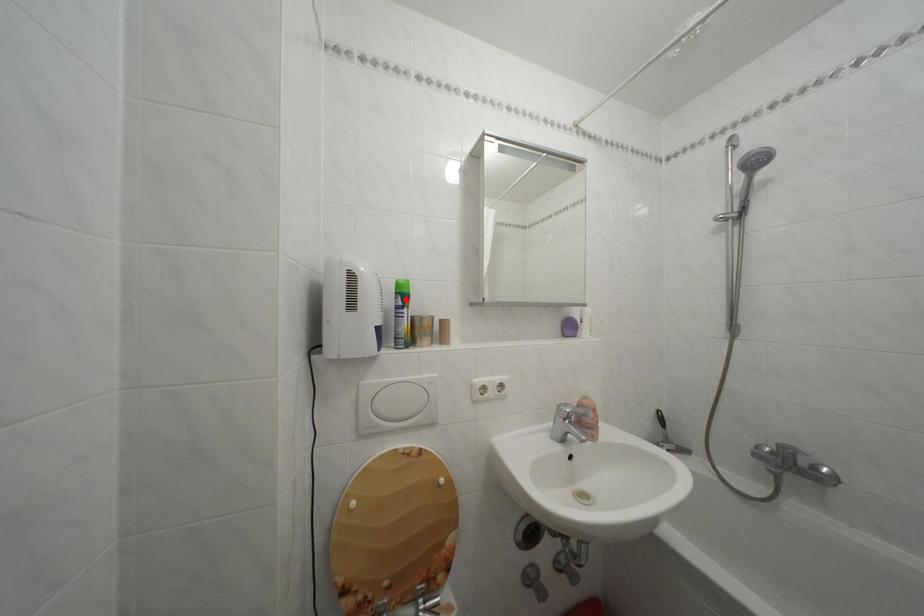
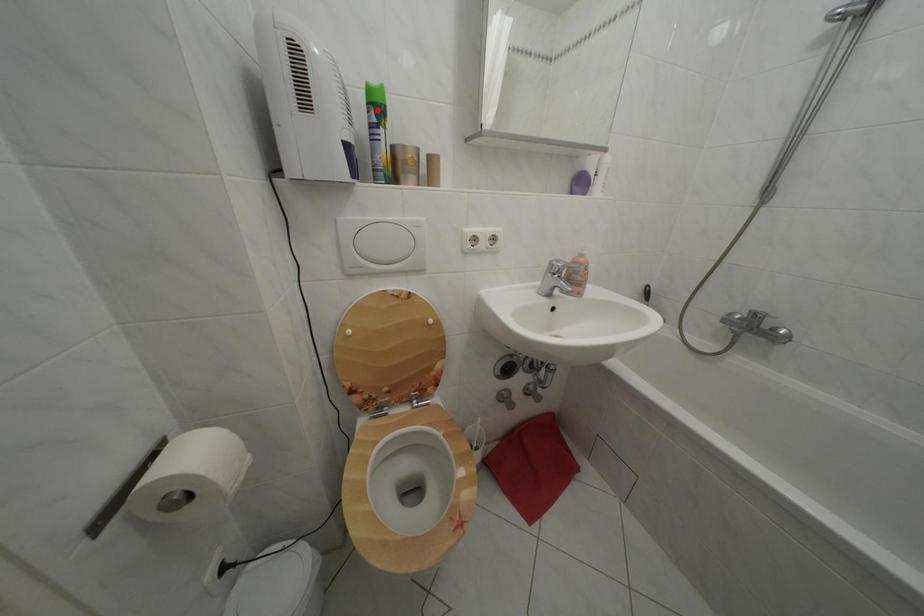
I am providing you with two images of the same scene from different viewpoints. A red point is marked on the first image and another point is marked on the second image. Is the marked point in image1 the same physical position as the marked point in image2?

Yes